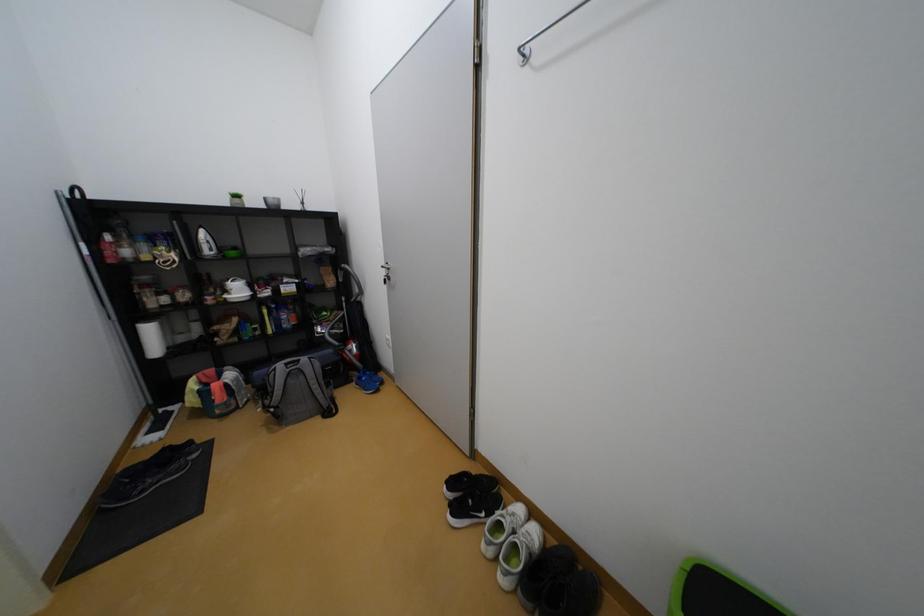
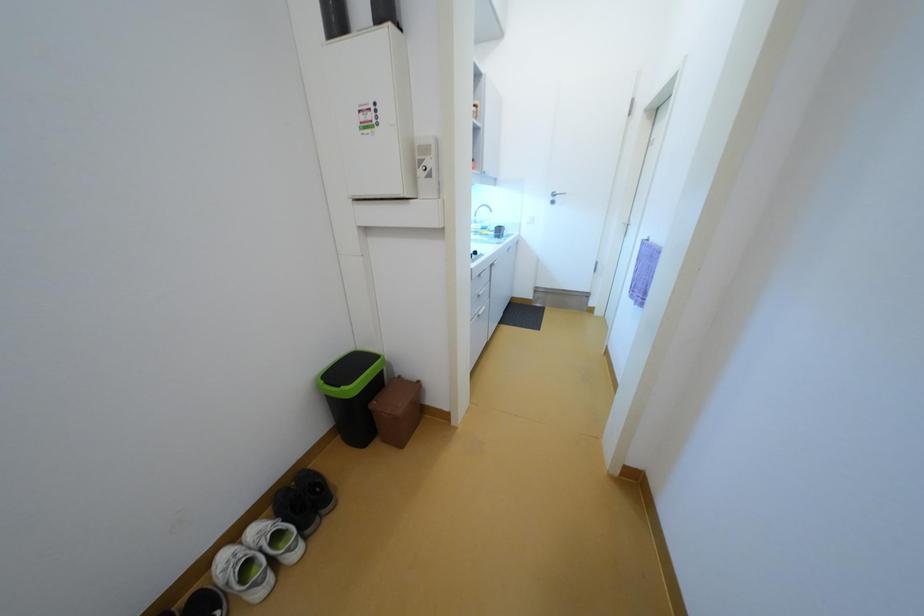
The first image is from the beginning of the video and the second image is from the end. How did the camera likely rotate when shooting the video?

The camera rotated toward right-down.